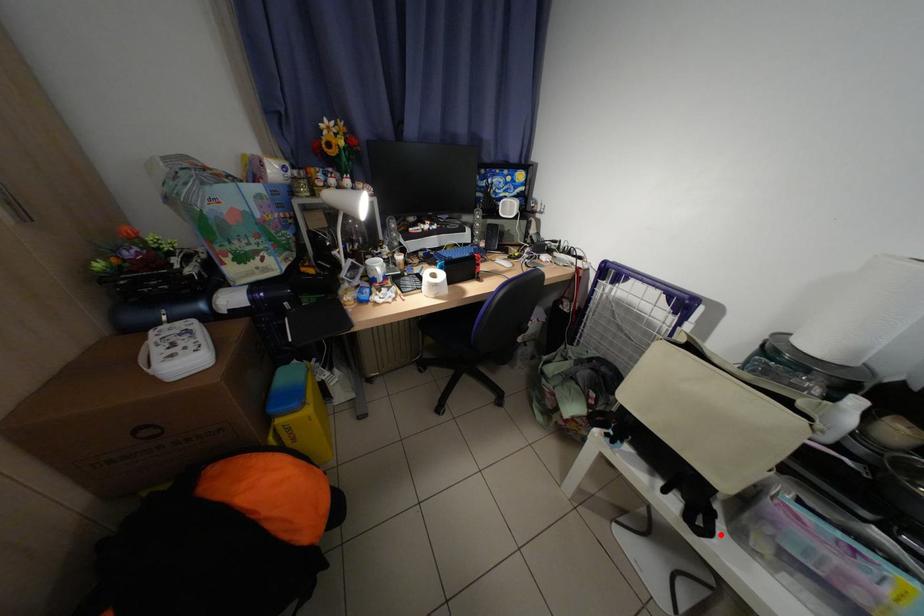
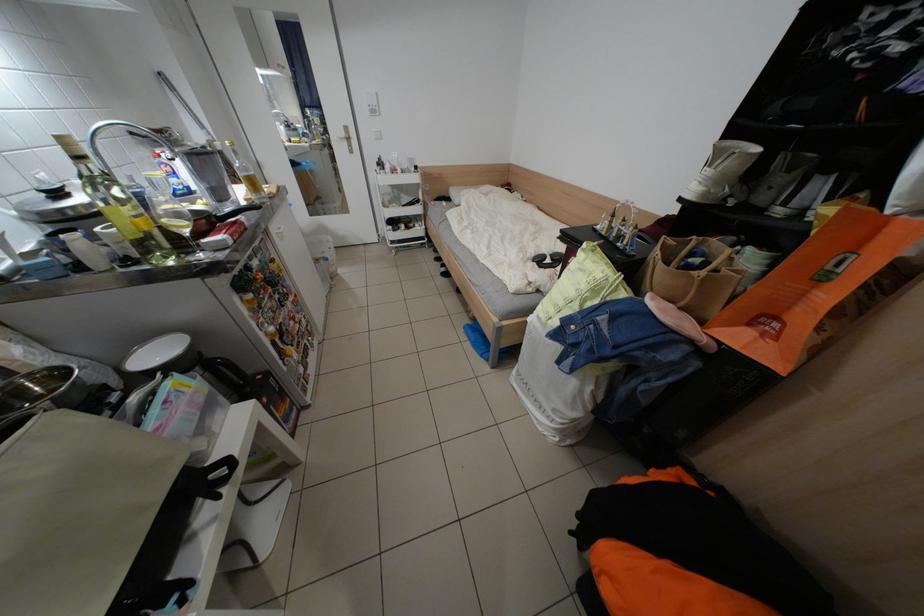
Question: I am providing you with two images of the same scene from different viewpoints. A red point is shown in image1. For the corresponding object point in image2, is it positioned nearer or farther from the camera?

Choices:
 (A) Nearer
 (B) Farther

Answer: (A)